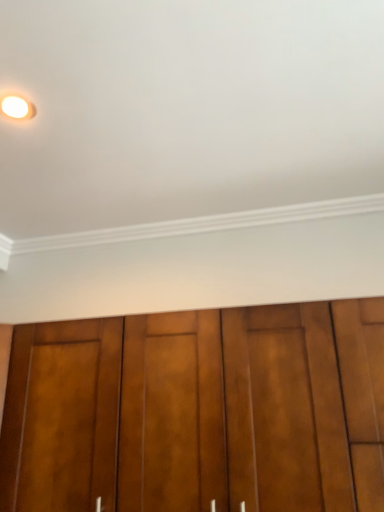
The width and height of the screenshot is (384, 512). What do you see at coordinates (198, 411) in the screenshot?
I see `brown wood door at lower center` at bounding box center [198, 411].

The image size is (384, 512). Find the location of `brown wood door at lower center`. brown wood door at lower center is located at coordinates (198, 411).

Identify the location of matte white light fixture at upper left. Image resolution: width=384 pixels, height=512 pixels. (17, 106).

What do you see at coordinates (17, 106) in the screenshot? I see `matte white light fixture at upper left` at bounding box center [17, 106].

This screenshot has width=384, height=512. Find the location of `brown wood door at lower center`. brown wood door at lower center is located at coordinates (198, 411).

Considering the positions of objects brown wood door at lower center and matte white light fixture at upper left in the image provided, who is more to the right, brown wood door at lower center or matte white light fixture at upper left?

brown wood door at lower center is more to the right.

Is brown wood door at lower center in front of or behind matte white light fixture at upper left in the image?

brown wood door at lower center is in front of matte white light fixture at upper left.

Between point (335, 458) and point (0, 110), which one is positioned in front?

The point (335, 458) is closer.

Looking at this image, from the image's perspective, relative to matte white light fixture at upper left, is brown wood door at lower center above or below?

brown wood door at lower center is situated lower than matte white light fixture at upper left in the image.

From a real-world perspective, who is located higher, brown wood door at lower center or matte white light fixture at upper left?

In real-world perspective, matte white light fixture at upper left is above.

From the picture: Considering the sizes of objects brown wood door at lower center and matte white light fixture at upper left in the image provided, who is wider, brown wood door at lower center or matte white light fixture at upper left?

brown wood door at lower center is wider.

Based on the photo, considering the relative sizes of brown wood door at lower center and matte white light fixture at upper left in the image provided, is brown wood door at lower center shorter than matte white light fixture at upper left?

Incorrect, the height of brown wood door at lower center does not fall short of that of matte white light fixture at upper left.

Considering the sizes of brown wood door at lower center and matte white light fixture at upper left in the image, is brown wood door at lower center bigger or smaller than matte white light fixture at upper left?

Considering their sizes, brown wood door at lower center takes up more space than matte white light fixture at upper left.

Would you say brown wood door at lower center is inside or outside matte white light fixture at upper left?

brown wood door at lower center is not inside matte white light fixture at upper left, it's outside.

Is brown wood door at lower center with matte white light fixture at upper left?

brown wood door at lower center is not next to matte white light fixture at upper left, and they're not touching.

Could you tell me if brown wood door at lower center is facing matte white light fixture at upper left?

No, brown wood door at lower center is not oriented towards matte white light fixture at upper left.

How different are the orientations of brown wood door at lower center and matte white light fixture at upper left in degrees?

brown wood door at lower center and matte white light fixture at upper left are facing 0.11 degrees away from each other.

You are a GUI agent. You are given a task and a screenshot of the screen. Output one action in this format:
    pyautogui.click(x=<x>, y=<y>)
    Task: Click on the door in front of the matte white light fixture at upper left
    The image size is (384, 512).
    Given the screenshot: What is the action you would take?
    pyautogui.click(x=198, y=411)

Considering the relative positions of matte white light fixture at upper left and brown wood door at lower center in the image provided, is matte white light fixture at upper left to the left or to the right of brown wood door at lower center?

matte white light fixture at upper left is positioned on brown wood door at lower center's left side.

Does matte white light fixture at upper left come behind brown wood door at lower center?

Yes, it is behind brown wood door at lower center.

Which point is more distant from viewer, (12, 118) or (170, 375)?

Positioned behind is point (170, 375).

From the image's perspective, is matte white light fixture at upper left above or below brown wood door at lower center?

Based on their image positions, matte white light fixture at upper left is located above brown wood door at lower center.

From a real-world perspective, between matte white light fixture at upper left and brown wood door at lower center, who is vertically higher?

From a 3D spatial view, matte white light fixture at upper left is above.

Is matte white light fixture at upper left wider or thinner than brown wood door at lower center?

matte white light fixture at upper left is thinner than brown wood door at lower center.

Can you confirm if matte white light fixture at upper left is taller than brown wood door at lower center?

Incorrect, the height of matte white light fixture at upper left is not larger of that of brown wood door at lower center.

Is matte white light fixture at upper left smaller than brown wood door at lower center?

Yes.

From the picture: Choose the correct answer: Is matte white light fixture at upper left inside brown wood door at lower center or outside it?

matte white light fixture at upper left is not inside brown wood door at lower center, it's outside.

Is there a large distance between matte white light fixture at upper left and brown wood door at lower center?

They are positioned close to each other.

Could you tell me if matte white light fixture at upper left is turned towards brown wood door at lower center?

No, matte white light fixture at upper left is not turned towards brown wood door at lower center.

How many degrees apart are the facing directions of matte white light fixture at upper left and brown wood door at lower center?

0.11 degrees separate the facing orientations of matte white light fixture at upper left and brown wood door at lower center.

At what (x,y) coordinates should I click in order to perform the action: click on lighting behind the brown wood door at lower center. Please return your answer as a coordinate pair (x, y). Looking at the image, I should click on (17, 106).

The height and width of the screenshot is (512, 384). In the image, there is a brown wood door at lower center. Find the location of `lighting above it (from the image's perspective)`. lighting above it (from the image's perspective) is located at coordinates (17, 106).

At what (x,y) coordinates should I click in order to perform the action: click on door below the matte white light fixture at upper left (from the image's perspective). Please return your answer as a coordinate pair (x, y). Looking at the image, I should click on (198, 411).